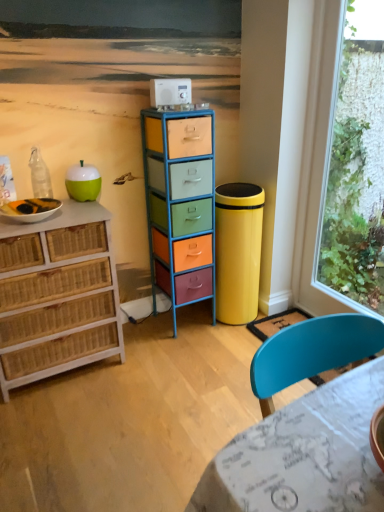
Question: Considering the relative sizes of transparent glass window at right and metallic multicolored drawers at center, placed as the 1th chest of drawers when sorted from right to left, in the image provided, is transparent glass window at right bigger than metallic multicolored drawers at center, placed as the 1th chest of drawers when sorted from right to left,?

Choices:
 (A) yes
 (B) no

Answer: (B)

Question: Can metallic multicolored drawers at center, placed as the 1th chest of drawers when sorted from right to left, be found inside transparent glass window at right?

Choices:
 (A) yes
 (B) no

Answer: (B)

Question: From a real-world perspective, is transparent glass window at right positioned over metallic multicolored drawers at center, placed as the 1th chest of drawers when sorted from right to left, based on gravity?

Choices:
 (A) yes
 (B) no

Answer: (A)

Question: Is transparent glass window at right positioned beyond the bounds of metallic multicolored drawers at center, placed as the 1th chest of drawers when sorted from right to left?

Choices:
 (A) no
 (B) yes

Answer: (B)

Question: Does transparent glass window at right appear on the left side of metallic multicolored drawers at center, placed as the 1th chest of drawers when sorted from right to left?

Choices:
 (A) yes
 (B) no

Answer: (B)

Question: Considering the relative sizes of transparent glass window at right and metallic multicolored drawers at center, which is counted as the 2th chest of drawers, starting from the left, in the image provided, is transparent glass window at right thinner than metallic multicolored drawers at center, which is counted as the 2th chest of drawers, starting from the left,?

Choices:
 (A) yes
 (B) no

Answer: (A)

Question: Does woven wood chest of drawers at left, the 1th chest of drawers from the left, have a smaller size compared to marble-patterned table at lower right?

Choices:
 (A) yes
 (B) no

Answer: (B)

Question: Is woven wood chest of drawers at left, the 1th chest of drawers from the left, bigger than marble-patterned table at lower right?

Choices:
 (A) no
 (B) yes

Answer: (B)

Question: From the image's perspective, is woven wood chest of drawers at left, the 1th chest of drawers from the left, under marble-patterned table at lower right?

Choices:
 (A) no
 (B) yes

Answer: (A)

Question: Does woven wood chest of drawers at left, placed as the 2th chest of drawers when sorted from right to left, appear on the left side of marble-patterned table at lower right?

Choices:
 (A) no
 (B) yes

Answer: (B)

Question: Is woven wood chest of drawers at left, the 1th chest of drawers from the left, thinner than marble-patterned table at lower right?

Choices:
 (A) yes
 (B) no

Answer: (A)

Question: Is woven wood chest of drawers at left, placed as the 2th chest of drawers when sorted from right to left, facing towards marble-patterned table at lower right?

Choices:
 (A) yes
 (B) no

Answer: (A)

Question: Could you tell me if marble-patterned table at lower right is facing green matte apple at left?

Choices:
 (A) yes
 (B) no

Answer: (B)